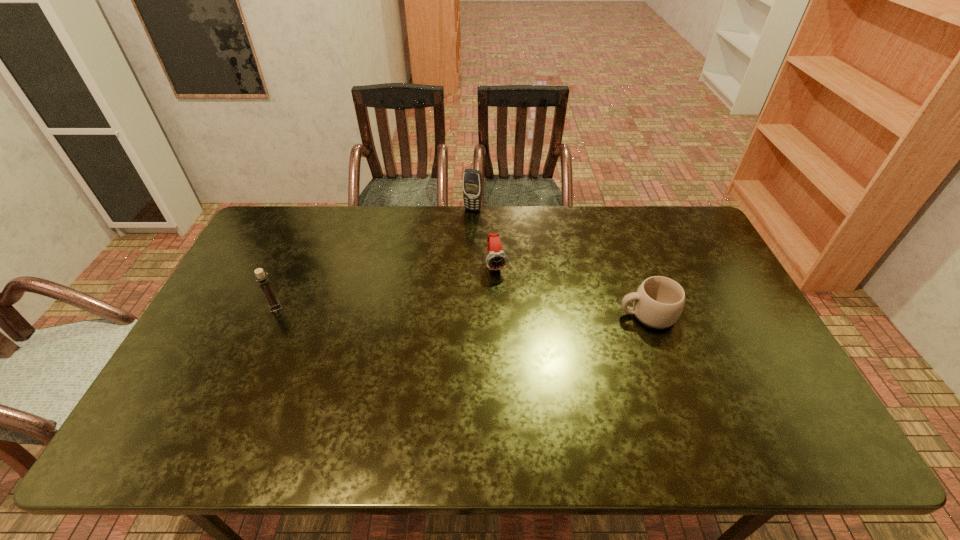
The image size is (960, 540). Find the location of `vacant space that's between the candle holder and the watch`. vacant space that's between the candle holder and the watch is located at coordinates (386, 286).

This screenshot has height=540, width=960. What are the coordinates of `vacant area between the second object from right to left and the rightmost object` in the screenshot? It's located at (572, 289).

Find the location of `free area in between the cellular telephone and the mug`. free area in between the cellular telephone and the mug is located at coordinates (561, 262).

This screenshot has width=960, height=540. I want to click on vacant space that is in between the watch and the farthest object, so click(x=485, y=237).

Identify which object is located as the nearest to the rightmost object. Please provide its 2D coordinates. Your answer should be formatted as a tuple, i.e. [(x, y)], where the tuple contains the x and y coordinates of a point satisfying the conditions above.

[(497, 259)]

Point out which object is positioned as the nearest to the watch. Please provide its 2D coordinates. Your answer should be formatted as a tuple, i.e. [(x, y)], where the tuple contains the x and y coordinates of a point satisfying the conditions above.

[(472, 179)]

Where is `vacant space that satisfies the following two spatial constraints: 1. on the front side of the second farthest object; 2. on the side of the rightmost object with the handle`? Image resolution: width=960 pixels, height=540 pixels. vacant space that satisfies the following two spatial constraints: 1. on the front side of the second farthest object; 2. on the side of the rightmost object with the handle is located at coordinates (499, 314).

The height and width of the screenshot is (540, 960). In order to click on vacant area in the image that satisfies the following two spatial constraints: 1. on the back side of the second farthest object; 2. on the left side of the candle holder in this screenshot , I will do `click(295, 265)`.

This screenshot has width=960, height=540. I want to click on vacant space that satisfies the following two spatial constraints: 1. on the front side of the mug; 2. on the side of the third nearest object with the handle, so click(x=499, y=314).